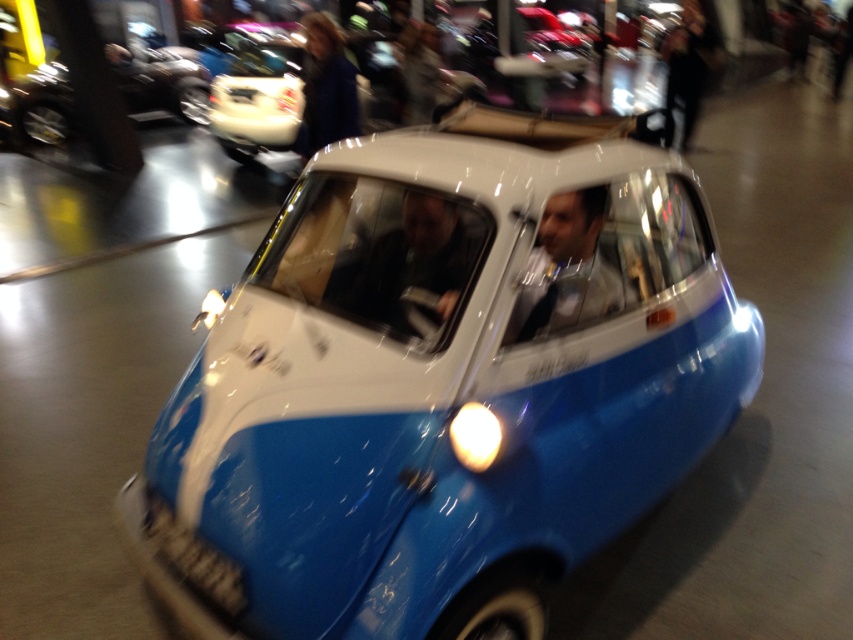
You are a child who wants to play with both the blue matte toy car at center and the blue matte car at upper left. Which one is larger in size?

The blue matte toy car at center is bigger than the blue matte car at upper left, so the blue matte toy car at center is larger in size.

You are a security guard at the car exhibition. You need to ensure that the matte black suit at center and the blue matte car at upper left can both fit through a narrow doorway that is 1.2 meters wide. Based on their sizes, will they both fit?

The matte black suit at center is smaller than the blue matte car at upper left. Since the car is larger, and the doorway is 1.2 meters wide, it depends on the car dimensions. However, since the car is indoors and at an exhibition, it might be a compact model. Without exact measurements, we can infer the car is smaller than 1.2 meters in width to be indoors. Therefore, both should fit.